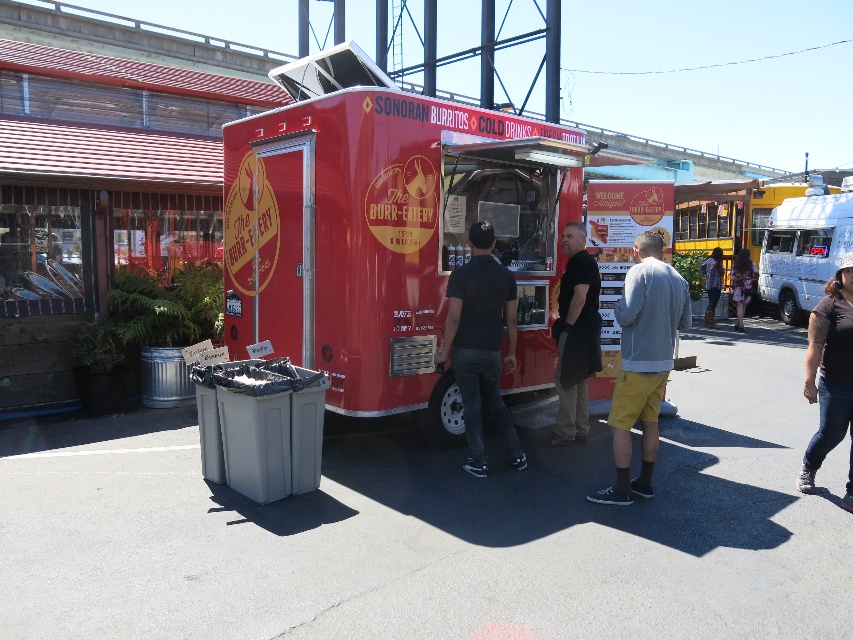
Question: Observing the image, what is the correct spatial positioning of black matte shirt at center in reference to floral shirt at center?

Choices:
 (A) left
 (B) right

Answer: (A)

Question: Which object appears farthest from the camera in this image?

Choices:
 (A) black matte shirt at center
 (B) floral shirt at center
 (C) shiny red food truck at center

Answer: (B)

Question: Is white glossy food truck at right positioned before white matte van at right?

Choices:
 (A) no
 (B) yes

Answer: (A)

Question: Based on their relative distances, which object is nearer to the floral shirt at center?

Choices:
 (A) white matte van at right
 (B) black matte shirt at center
 (C) gray fleece jacket at center
 (D) dark brown leather jacket at center

Answer: (A)

Question: Does shiny red food truck at center appear under white glossy food truck at right?

Choices:
 (A) no
 (B) yes

Answer: (B)

Question: Which of the following is the farthest from the observer?

Choices:
 (A) gray fleece jacket at center
 (B) floral shirt at center
 (C) dark brown leather jacket at center
 (D) white glossy food truck at right

Answer: (D)